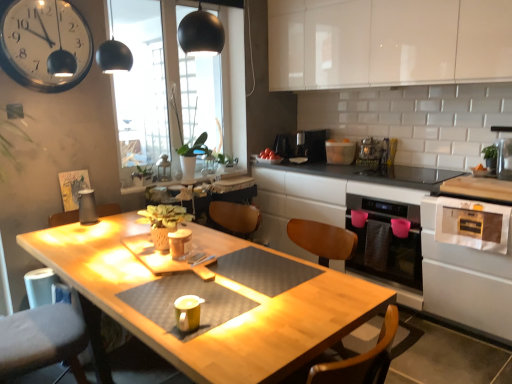
Question: Is white glossy oven at lower right, placed as the 2th oven when sorted from back to front, positioned with its back to green matte plant at center?

Choices:
 (A) yes
 (B) no

Answer: (B)

Question: Does white glossy oven at lower right, the 1th oven in the front-to-back sequence, have a lesser width compared to green matte plant at center?

Choices:
 (A) yes
 (B) no

Answer: (B)

Question: Considering the relative positions of white glossy oven at lower right, the 1th oven in the front-to-back sequence, and green matte plant at center in the image provided, is white glossy oven at lower right, the 1th oven in the front-to-back sequence, in front of green matte plant at center?

Choices:
 (A) yes
 (B) no

Answer: (A)

Question: From a real-world perspective, does white glossy oven at lower right, placed as the 2th oven when sorted from back to front, stand above green matte plant at center?

Choices:
 (A) yes
 (B) no

Answer: (B)

Question: Is white glossy oven at lower right, placed as the 2th oven when sorted from back to front, placed right next to green matte plant at center?

Choices:
 (A) yes
 (B) no

Answer: (B)

Question: Is black plastic coffee maker at center, which is the 1th appliance from back to front, to the left or to the right of black glossy oven at lower right, arranged as the 2th oven when viewed from the front, in the image?

Choices:
 (A) left
 (B) right

Answer: (A)

Question: Would you say black plastic coffee maker at center, arranged as the fifth appliance when viewed from the right, is inside or outside black glossy oven at lower right, which is the first oven from back to front?

Choices:
 (A) outside
 (B) inside

Answer: (A)

Question: In terms of height, does black plastic coffee maker at center, the fourth appliance viewed from the left, look taller or shorter compared to black glossy oven at lower right, which is the first oven from back to front?

Choices:
 (A) short
 (B) tall

Answer: (A)

Question: In the image, is black plastic coffee maker at center, the 8th appliance when ordered from front to back, positioned in front of or behind black glossy oven at lower right, which is the first oven from back to front?

Choices:
 (A) behind
 (B) front

Answer: (A)

Question: In terms of size, does black plastic coffee maker at upper center, the 7th appliance viewed from the front, appear bigger or smaller than white glossy oven at lower right, placed as the 2th oven when sorted from back to front?

Choices:
 (A) small
 (B) big

Answer: (A)

Question: Which is correct: black plastic coffee maker at upper center, the 2th appliance in the back-to-front sequence, is inside white glossy oven at lower right, the 1th oven in the front-to-back sequence, or outside of it?

Choices:
 (A) inside
 (B) outside

Answer: (B)

Question: Considering the positions of black plastic coffee maker at upper center, the fourth appliance when ordered from right to left, and white glossy oven at lower right, the 1th oven in the front-to-back sequence, in the image, is black plastic coffee maker at upper center, the fourth appliance when ordered from right to left, wider or thinner than white glossy oven at lower right, the 1th oven in the front-to-back sequence,?

Choices:
 (A) thin
 (B) wide

Answer: (A)

Question: From the image's perspective, is black plastic coffee maker at upper center, positioned as the 5th appliance in left-to-right order, above or below white glossy oven at lower right, the 1th oven in the front-to-back sequence?

Choices:
 (A) above
 (B) below

Answer: (A)

Question: From a real-world perspective, relative to white glossy countertop at center, is white glossy clock at upper left vertically above or below?

Choices:
 (A) above
 (B) below

Answer: (A)

Question: Considering their positions, is white glossy clock at upper left located in front of or behind white glossy countertop at center?

Choices:
 (A) behind
 (B) front

Answer: (A)